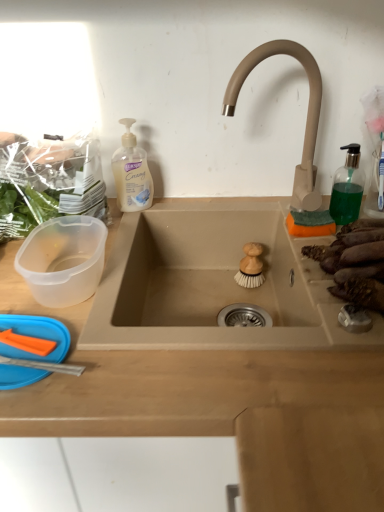
This screenshot has height=512, width=384. What do you see at coordinates (347, 187) in the screenshot? I see `green translucent soap dispenser at right` at bounding box center [347, 187].

Describe the element at coordinates (307, 113) in the screenshot. The width and height of the screenshot is (384, 512). I see `beige matte faucet at upper right` at that location.

This screenshot has width=384, height=512. Describe the element at coordinates (131, 173) in the screenshot. I see `white creamy liquid soap at upper left` at that location.

Identify the location of brown matte sweet potatoes at right, which is the third food from left to right. (355, 263).

Where is `green leafy vegetables at left, placed as the 3th food when sorted from right to left`? The image size is (384, 512). green leafy vegetables at left, placed as the 3th food when sorted from right to left is located at coordinates (47, 182).

Considering the relative positions of white creamy liquid soap at upper left and green translucent soap dispenser at right in the image provided, is white creamy liquid soap at upper left to the right of green translucent soap dispenser at right from the viewer's perspective?

In fact, white creamy liquid soap at upper left is to the left of green translucent soap dispenser at right.

Can you confirm if white creamy liquid soap at upper left is thinner than green translucent soap dispenser at right?

No.

From the image's perspective, which is above, white creamy liquid soap at upper left or green translucent soap dispenser at right?

white creamy liquid soap at upper left, from the image's perspective.

Is green translucent soap dispenser at right inside white creamy liquid soap at upper left?

Actually, green translucent soap dispenser at right is outside white creamy liquid soap at upper left.

How distant is green leafy vegetables at left, placed as the 3th food when sorted from right to left, from beige wood countertop at center?

A distance of 32.46 centimeters exists between green leafy vegetables at left, placed as the 3th food when sorted from right to left, and beige wood countertop at center.

Considering the relative sizes of green leafy vegetables at left, placed as the 3th food when sorted from right to left, and beige wood countertop at center in the image provided, is green leafy vegetables at left, placed as the 3th food when sorted from right to left, thinner than beige wood countertop at center?

Yes, green leafy vegetables at left, placed as the 3th food when sorted from right to left, is thinner than beige wood countertop at center.

Are green leafy vegetables at left, which appears as the 1th food when viewed from the left, and beige wood countertop at center located far from each other?

green leafy vegetables at left, which appears as the 1th food when viewed from the left, is actually quite close to beige wood countertop at center.

Considering their positions, is green leafy vegetables at left, placed as the 3th food when sorted from right to left, located in front of or behind beige wood countertop at center?

Visually, green leafy vegetables at left, placed as the 3th food when sorted from right to left, is located behind beige wood countertop at center.

In the scene shown: Between green leafy vegetables at left, placed as the 3th food when sorted from right to left, and green translucent soap dispenser at right, which one has less height?

With less height is green translucent soap dispenser at right.

How different are the orientations of green leafy vegetables at left, which appears as the 1th food when viewed from the left, and green translucent soap dispenser at right in degrees?

0.153 degrees separate the facing orientations of green leafy vegetables at left, which appears as the 1th food when viewed from the left, and green translucent soap dispenser at right.

Which object is wider, green leafy vegetables at left, which appears as the 1th food when viewed from the left, or green translucent soap dispenser at right?

With larger width is green leafy vegetables at left, which appears as the 1th food when viewed from the left.

Which of these two, beige matte faucet at upper right or green translucent soap dispenser at right, stands taller?

beige matte faucet at upper right is taller.

Can you tell me how much beige matte faucet at upper right and green translucent soap dispenser at right differ in facing direction?

The angle between the facing direction of beige matte faucet at upper right and the facing direction of green translucent soap dispenser at right is 0.221 degrees.

Between beige matte faucet at upper right and green translucent soap dispenser at right, which one has smaller width?

green translucent soap dispenser at right is thinner.

Is the surface of beige matte faucet at upper right in direct contact with green translucent soap dispenser at right?

No, beige matte faucet at upper right is not touching green translucent soap dispenser at right.

How far apart are brown matte sweet potatoes at right, acting as the first food starting from the right, and beige matte faucet at upper right?

The distance of brown matte sweet potatoes at right, acting as the first food starting from the right, from beige matte faucet at upper right is 9.65 inches.

Between brown matte sweet potatoes at right, acting as the first food starting from the right, and beige matte faucet at upper right, which one has less height?

With less height is brown matte sweet potatoes at right, acting as the first food starting from the right.

Is brown matte sweet potatoes at right, acting as the first food starting from the right, aimed at beige matte faucet at upper right?

No, brown matte sweet potatoes at right, acting as the first food starting from the right, does not turn towards beige matte faucet at upper right.

From the image's perspective, is brown matte sweet potatoes at right, acting as the first food starting from the right, above or below beige matte faucet at upper right?

Based on their image positions, brown matte sweet potatoes at right, acting as the first food starting from the right, is located beneath beige matte faucet at upper right.

Are wooden brush at sink center, which is the 2th food from right to left, and green translucent soap dispenser at right far apart?

No, wooden brush at sink center, which is the 2th food from right to left, is in close proximity to green translucent soap dispenser at right.

From the image's perspective, between wooden brush at sink center, which is the 2th food from right to left, and green translucent soap dispenser at right, who is located below?

wooden brush at sink center, which is the 2th food from right to left, appears lower in the image.

Where is `soap dispenser on the right of wooden brush at sink center, which is the 2th food from right to left`? soap dispenser on the right of wooden brush at sink center, which is the 2th food from right to left is located at coordinates (347, 187).

In order to click on food that is the 1st one above the wooden brush at sink center, which is the 2th food from right to left (from a real-world perspective) in this screenshot , I will do `click(355, 263)`.

Is brown matte sweet potatoes at right, acting as the first food starting from the right, not within wooden brush at sink center, which is the 2th food from right to left?

Yes, brown matte sweet potatoes at right, acting as the first food starting from the right, is located beyond the bounds of wooden brush at sink center, which is the 2th food from right to left.

Can you confirm if brown matte sweet potatoes at right, which is the third food from left to right, is thinner than wooden brush at sink center, which is the 2th food from right to left?

Incorrect, the width of brown matte sweet potatoes at right, which is the third food from left to right, is not less than that of wooden brush at sink center, which is the 2th food from right to left.

Are brown matte sweet potatoes at right, acting as the first food starting from the right, and wooden brush at sink center, which is the 2th food from right to left, beside each other?

brown matte sweet potatoes at right, acting as the first food starting from the right, and wooden brush at sink center, which is the 2th food from right to left, are not in contact.

You are a GUI agent. You are given a task and a screenshot of the screen. Output one action in this format:
    pyautogui.click(x=<x>, y=<y>)
    Task: Click on the soap dispenser below the white creamy liquid soap at upper left (from a real-world perspective)
    The image size is (384, 512).
    Given the screenshot: What is the action you would take?
    pyautogui.click(x=347, y=187)

Identify the location of the 2nd food positioned above the beige wood countertop at center (from a real-world perspective). This screenshot has height=512, width=384. (47, 182).

From the image, which object appears to be farther from white creamy liquid soap at upper left, green leafy vegetables at left, which appears as the 1th food when viewed from the left, or beige matte faucet at upper right?

beige matte faucet at upper right is further to white creamy liquid soap at upper left.

Which object lies nearer to the anchor point green translucent soap dispenser at right, beige wood countertop at center or beige matte faucet at upper right?

Based on the image, beige matte faucet at upper right appears to be nearer to green translucent soap dispenser at right.

Estimate the real-world distances between objects in this image. Which object is closer to beige matte faucet at upper right, brown matte sweet potatoes at right, which is the third food from left to right, or white creamy liquid soap at upper left?

Based on the image, brown matte sweet potatoes at right, which is the third food from left to right, appears to be nearer to beige matte faucet at upper right.

Looking at the image, which one is located further to wooden brush at sink center, which is counted as the second food, starting from the left, white creamy liquid soap at upper left or green translucent soap dispenser at right?

white creamy liquid soap at upper left is positioned further to the anchor wooden brush at sink center, which is counted as the second food, starting from the left.

Which object lies further to the anchor point brown matte sweet potatoes at right, which is the third food from left to right, wooden brush at sink center, which is the 2th food from right to left, or beige matte faucet at upper right?

wooden brush at sink center, which is the 2th food from right to left, lies further to brown matte sweet potatoes at right, which is the third food from left to right, than the other object.

From the image, which object appears to be farther from wooden brush at sink center, which is the 2th food from right to left, green leafy vegetables at left, which appears as the 1th food when viewed from the left, or white creamy liquid soap at upper left?

Based on the image, green leafy vegetables at left, which appears as the 1th food when viewed from the left, appears to be further to wooden brush at sink center, which is the 2th food from right to left.

Estimate the real-world distances between objects in this image. Which object is closer to green leafy vegetables at left, which appears as the 1th food when viewed from the left, green translucent soap dispenser at right or brown matte sweet potatoes at right, acting as the first food starting from the right?

The object closer to green leafy vegetables at left, which appears as the 1th food when viewed from the left, is brown matte sweet potatoes at right, acting as the first food starting from the right.

From the image, which object appears to be farther from white creamy liquid soap at upper left, wooden brush at sink center, which is the 2th food from right to left, or beige wood countertop at center?

beige wood countertop at center is positioned further to the anchor white creamy liquid soap at upper left.

At what (x,y) coordinates should I click in order to perform the action: click on countertop located between white creamy liquid soap at upper left and green translucent soap dispenser at right in the left-right direction. Please return your answer as a coordinate pair (x, y). This screenshot has height=512, width=384. Looking at the image, I should click on (221, 408).

Where is `cleaning product between beige wood countertop at center and wooden brush at sink center, which is the 2th food from right to left, from front to back`? This screenshot has height=512, width=384. cleaning product between beige wood countertop at center and wooden brush at sink center, which is the 2th food from right to left, from front to back is located at coordinates (131, 173).

Identify the location of food between green leafy vegetables at left, placed as the 3th food when sorted from right to left, and beige wood countertop at center. (251, 267).

Where is `soap dispenser between beige matte faucet at upper right and wooden brush at sink center, which is the 2th food from right to left, from top to bottom`? The width and height of the screenshot is (384, 512). soap dispenser between beige matte faucet at upper right and wooden brush at sink center, which is the 2th food from right to left, from top to bottom is located at coordinates (347, 187).